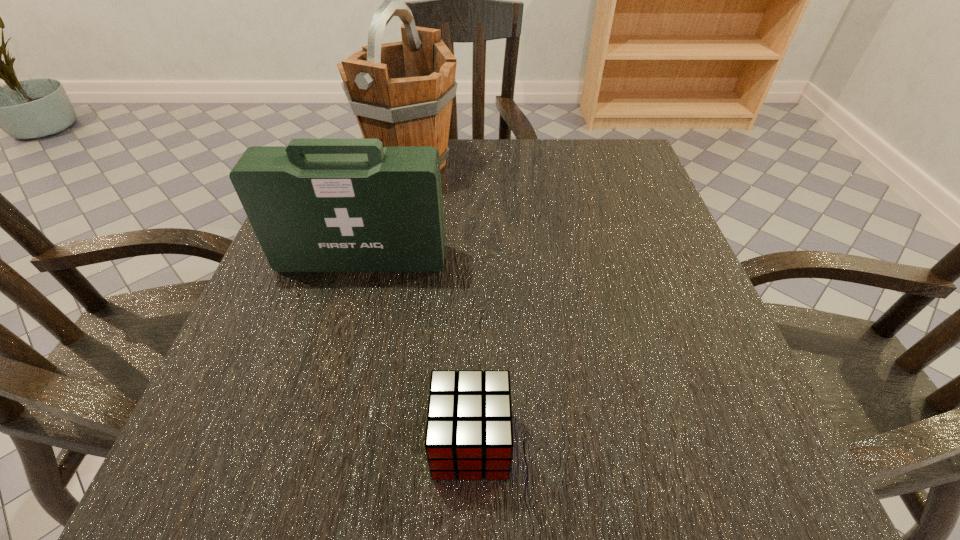
You are a GUI agent. You are given a task and a screenshot of the screen. Output one action in this format:
    pyautogui.click(x=<x>, y=<y>)
    Task: Click on the tallest object
    
    Given the screenshot: What is the action you would take?
    pyautogui.click(x=401, y=93)

Locate an element on the screen. the farthest object is located at coordinates (401, 93).

Where is `the second tallest object`? The width and height of the screenshot is (960, 540). the second tallest object is located at coordinates (317, 205).

The image size is (960, 540). I want to click on the second farthest object, so click(317, 205).

Locate an element on the screen. the nearest object is located at coordinates (469, 431).

Locate an element on the screen. cube is located at coordinates (469, 431).

Locate an element on the screen. vacant region located 0.220m on the right of the farthest object is located at coordinates (556, 164).

The image size is (960, 540). I want to click on vacant region located 0.330m on the front-facing side of the first-aid kit, so click(307, 462).

At what (x,y) coordinates should I click in order to perform the action: click on vacant area located 0.050m on the right of the cube. Please return your answer as a coordinate pair (x, y). This screenshot has height=540, width=960. Looking at the image, I should click on (547, 442).

Locate an element on the screen. object situated at the far edge is located at coordinates (401, 93).